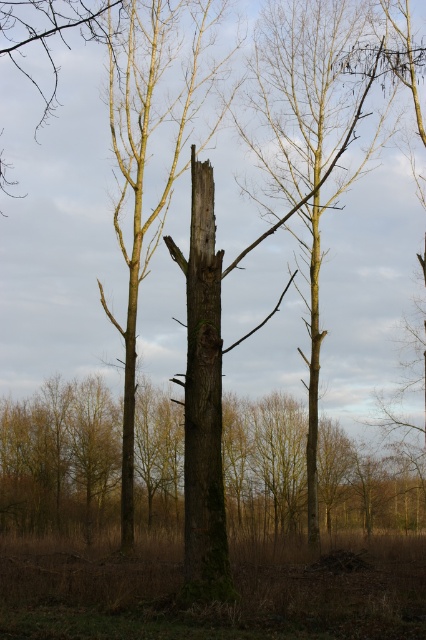
Question: Considering the relative positions of smooth bark tree at center and green mossy bark at center in the image provided, where is smooth bark tree at center located with respect to green mossy bark at center?

Choices:
 (A) left
 (B) right

Answer: (B)

Question: Which point is farther to the camera?

Choices:
 (A) (256, 88)
 (B) (227, 566)

Answer: (A)

Question: Does smooth bark tree at center have a lesser width compared to green mossy bark at center?

Choices:
 (A) yes
 (B) no

Answer: (B)

Question: Can you confirm if smooth bark tree at center is smaller than green mossy bark at center?

Choices:
 (A) yes
 (B) no

Answer: (B)